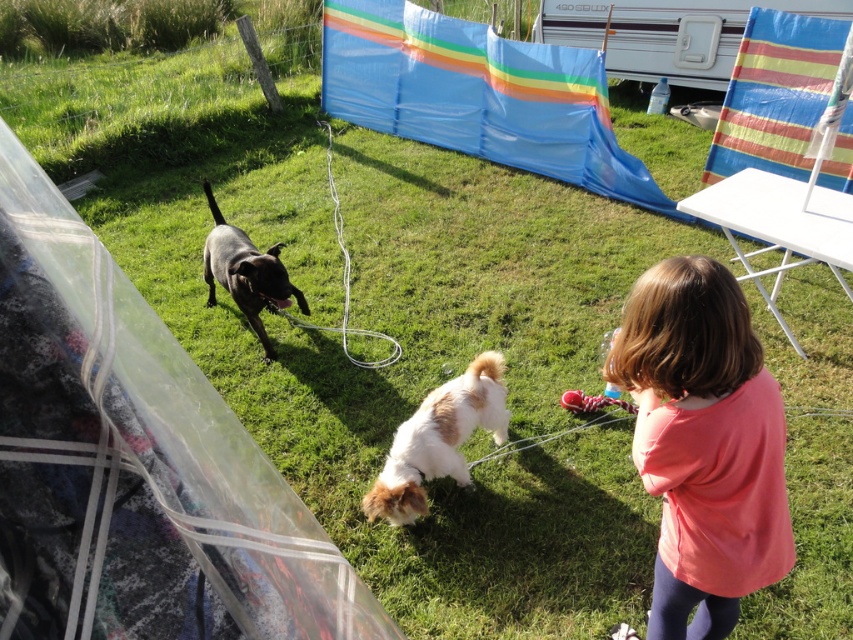
Can you confirm if brown and white fur at center is smaller than shiny black dog at center?

Yes.

Is brown and white fur at center shorter than shiny black dog at center?

→ Yes, brown and white fur at center is shorter than shiny black dog at center.

The image size is (853, 640). Describe the element at coordinates (438, 440) in the screenshot. I see `brown and white fur at center` at that location.

Identify the location of brown and white fur at center. The height and width of the screenshot is (640, 853). (438, 440).

Which of these two, pink cotton shirt at lower right or brown and white fur at center, stands shorter?

brown and white fur at center is shorter.

Can you confirm if pink cotton shirt at lower right is wider than brown and white fur at center?

In fact, pink cotton shirt at lower right might be narrower than brown and white fur at center.

Does point (660, 461) come in front of point (434, 408)?

Yes.

The width and height of the screenshot is (853, 640). Find the location of `pink cotton shirt at lower right`. pink cotton shirt at lower right is located at coordinates (703, 444).

Consider the image. Is pink cotton shirt at lower right positioned in front of shiny black dog at center?

Yes, it is in front of shiny black dog at center.

Is pink cotton shirt at lower right taller than shiny black dog at center?

Yes, pink cotton shirt at lower right is taller than shiny black dog at center.

At what (x,y) coordinates should I click in order to perform the action: click on pink cotton shirt at lower right. Please return your answer as a coordinate pair (x, y). The height and width of the screenshot is (640, 853). Looking at the image, I should click on (703, 444).

I want to click on pink cotton shirt at lower right, so click(x=703, y=444).